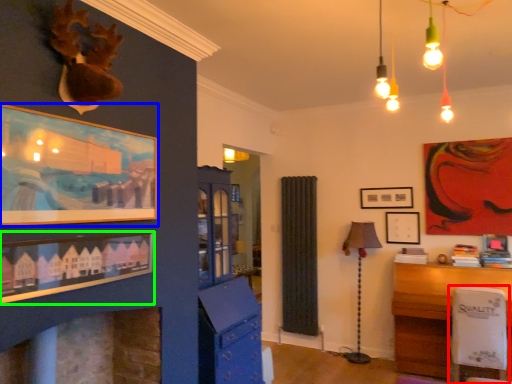
Question: Which object is the farthest from swivel chair (highlighted by a red box)? Choose among these: picture frame (highlighted by a blue box) or picture frame (highlighted by a green box).

Choices:
 (A) picture frame
 (B) picture frame

Answer: (A)